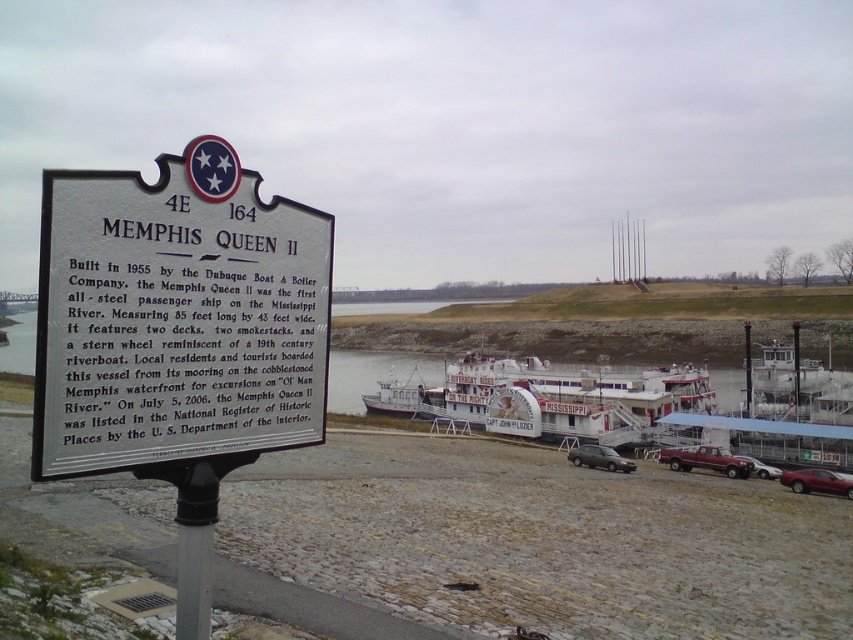
Based on the scene description, what are the coordinates of the white painted wood boat at center?

The white painted wood boat at center is located at coordinates (x=549, y=397).

You are a photographer planning to take a wide shot of the white painted wood boat at center and the shiny red sedan at lower right. Based on their sizes, which object should you prioritize positioning closer to the camera to ensure both fit in the frame?

The white painted wood boat at center is wider than the shiny red sedan at lower right, so you should position the wider boat closer to the camera to ensure both fit in the frame.

You are standing at the riverside and see the shiny red sedan at lower right and the metallic gray sedan at center. Which sedan is closer to you?

The shiny red sedan at lower right is closer to the viewer than the metallic gray sedan at center.